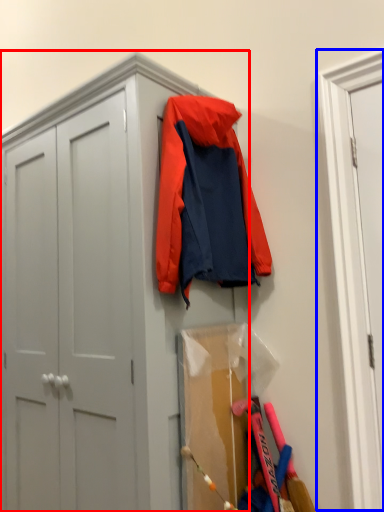
Question: Which object is closer to the camera taking this photo, cabinetry (highlighted by a red box) or door (highlighted by a blue box)?

Choices:
 (A) cabinetry
 (B) door

Answer: (A)